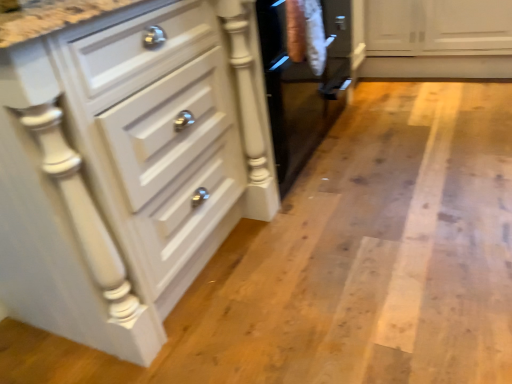
Where is `spots to the right of white glossy cabinet at center`? spots to the right of white glossy cabinet at center is located at coordinates (358, 255).